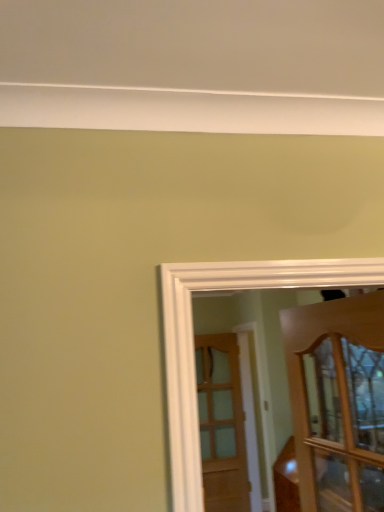
What are the coordinates of `wooden cabinet at right, placed as the 1th door when sorted from front to back` in the screenshot? It's located at (338, 401).

The image size is (384, 512). What do you see at coordinates (338, 401) in the screenshot? I see `wooden cabinet at right, placed as the 1th door when sorted from front to back` at bounding box center [338, 401].

This screenshot has height=512, width=384. What do you see at coordinates (221, 424) in the screenshot?
I see `wooden door at center, which appears as the second door when viewed from the top` at bounding box center [221, 424].

What is the approximate width of wooden door at center, which appears as the second door when viewed from the top?

The width of wooden door at center, which appears as the second door when viewed from the top, is 5.07 centimeters.

This screenshot has height=512, width=384. In order to click on wooden door at center, positioned as the 1th door in bottom-to-top order in this screenshot , I will do `click(221, 424)`.

Find the location of a particular element. wooden cabinet at right, the 2th door when ordered from bottom to top is located at coordinates (338, 401).

Between wooden cabinet at right, the second door viewed from the back, and wooden door at center, positioned as the first door in back-to-front order, which one appears on the left side from the viewer's perspective?

wooden door at center, positioned as the first door in back-to-front order.

Which object is more forward, wooden cabinet at right, which appears as the 1th door when viewed from the top, or wooden door at center, which appears as the second door when viewed from the top?

wooden cabinet at right, which appears as the 1th door when viewed from the top, is more forward.

Does point (373, 467) lie behind point (214, 498)?

No, (373, 467) is in front of (214, 498).

From the image's perspective, is wooden cabinet at right, which appears as the 1th door when viewed from the top, located above wooden door at center, which appears as the second door when viewed from the top?

Correct, wooden cabinet at right, which appears as the 1th door when viewed from the top, appears higher than wooden door at center, which appears as the second door when viewed from the top, in the image.

From a real-world perspective, between wooden cabinet at right, placed as the 1th door when sorted from front to back, and wooden door at center, the 2th door from the front, who is vertically lower?

wooden door at center, the 2th door from the front, is physically lower.

Which of these two, wooden cabinet at right, the second door viewed from the back, or wooden door at center, positioned as the 1th door in bottom-to-top order, is thinner?

wooden door at center, positioned as the 1th door in bottom-to-top order, is thinner.

Considering the sizes of objects wooden cabinet at right, placed as the 1th door when sorted from front to back, and wooden door at center, which appears as the second door when viewed from the top, in the image provided, who is shorter, wooden cabinet at right, placed as the 1th door when sorted from front to back, or wooden door at center, which appears as the second door when viewed from the top,?

wooden cabinet at right, placed as the 1th door when sorted from front to back.

Consider the image. Considering the relative sizes of wooden cabinet at right, placed as the 1th door when sorted from front to back, and wooden door at center, the 2th door from the front, in the image provided, is wooden cabinet at right, placed as the 1th door when sorted from front to back, smaller than wooden door at center, the 2th door from the front,?

Correct, wooden cabinet at right, placed as the 1th door when sorted from front to back, occupies less space than wooden door at center, the 2th door from the front.

Is wooden cabinet at right, the 2th door when ordered from bottom to top, inside or outside of wooden door at center, positioned as the first door in back-to-front order?

wooden cabinet at right, the 2th door when ordered from bottom to top, lies outside wooden door at center, positioned as the first door in back-to-front order.

Is wooden cabinet at right, placed as the 1th door when sorted from front to back, in contact with wooden door at center, which appears as the second door when viewed from the top?

No, wooden cabinet at right, placed as the 1th door when sorted from front to back, is not beside wooden door at center, which appears as the second door when viewed from the top.

Is wooden cabinet at right, which appears as the 1th door when viewed from the top, positioned with its back to wooden door at center, positioned as the first door in back-to-front order?

No, wooden cabinet at right, which appears as the 1th door when viewed from the top, is not facing the opposite direction of wooden door at center, positioned as the first door in back-to-front order.

Where is `door on the right side of wooden door at center, the 2th door from the front`? The width and height of the screenshot is (384, 512). door on the right side of wooden door at center, the 2th door from the front is located at coordinates (338, 401).

Does wooden door at center, positioned as the 1th door in bottom-to-top order, appear on the right side of wooden cabinet at right, the 2th door when ordered from bottom to top?

In fact, wooden door at center, positioned as the 1th door in bottom-to-top order, is to the left of wooden cabinet at right, the 2th door when ordered from bottom to top.

Is wooden door at center, which appears as the second door when viewed from the top, in front of or behind wooden cabinet at right, which appears as the 1th door when viewed from the top, in the image?

Clearly, wooden door at center, which appears as the second door when viewed from the top, is behind wooden cabinet at right, which appears as the 1th door when viewed from the top.

Does point (214, 446) lie in front of point (339, 409)?

No.

From the image's perspective, is wooden door at center, the 2th door from the front, on top of wooden cabinet at right, the 2th door when ordered from bottom to top?

Actually, wooden door at center, the 2th door from the front, appears below wooden cabinet at right, the 2th door when ordered from bottom to top, in the image.

From a real-world perspective, which is physically above, wooden door at center, which appears as the second door when viewed from the top, or wooden cabinet at right, placed as the 1th door when sorted from front to back?

In real-world perspective, wooden cabinet at right, placed as the 1th door when sorted from front to back, is above.

Considering the sizes of objects wooden door at center, positioned as the first door in back-to-front order, and wooden cabinet at right, the second door viewed from the back, in the image provided, who is wider, wooden door at center, positioned as the first door in back-to-front order, or wooden cabinet at right, the second door viewed from the back,?

Wider between the two is wooden cabinet at right, the second door viewed from the back.

Can you confirm if wooden door at center, positioned as the first door in back-to-front order, is taller than wooden cabinet at right, the second door viewed from the back?

Yes, wooden door at center, positioned as the first door in back-to-front order, is taller than wooden cabinet at right, the second door viewed from the back.

Between wooden door at center, the 2th door from the front, and wooden cabinet at right, placed as the 1th door when sorted from front to back, which one has smaller size?

Smaller between the two is wooden cabinet at right, placed as the 1th door when sorted from front to back.

Would you say wooden door at center, which appears as the second door when viewed from the top, is inside or outside wooden cabinet at right, the 2th door when ordered from bottom to top?

wooden door at center, which appears as the second door when viewed from the top, is located beyond the bounds of wooden cabinet at right, the 2th door when ordered from bottom to top.

Is wooden door at center, the 2th door from the front, not close to wooden cabinet at right, placed as the 1th door when sorted from front to back?

That's right, there is a large distance between wooden door at center, the 2th door from the front, and wooden cabinet at right, placed as the 1th door when sorted from front to back.

Is wooden door at center, positioned as the 1th door in bottom-to-top order, facing towards wooden cabinet at right, the second door viewed from the back?

Yes, wooden door at center, positioned as the 1th door in bottom-to-top order, is oriented towards wooden cabinet at right, the second door viewed from the back.

Can you tell me how much wooden door at center, positioned as the 1th door in bottom-to-top order, and wooden cabinet at right, which appears as the 1th door when viewed from the top, differ in facing direction?

They differ by 84 degrees in their facing directions.

Identify the location of door on the left of wooden cabinet at right, placed as the 1th door when sorted from front to back. The height and width of the screenshot is (512, 384). (221, 424).

Identify the location of door that is under the wooden cabinet at right, the second door viewed from the back (from a real-world perspective). This screenshot has height=512, width=384. (221, 424).

In order to click on door on the right of wooden door at center, which appears as the second door when viewed from the top in this screenshot , I will do `click(338, 401)`.